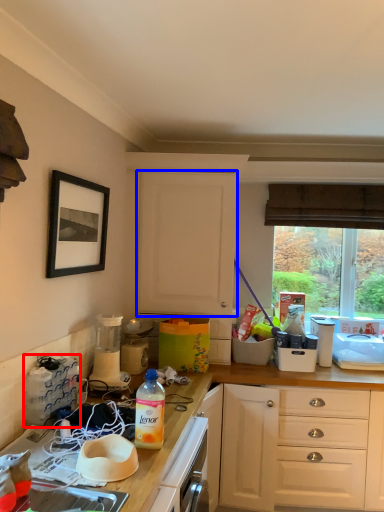
Question: Among these objects, which one is farthest to the camera, appliance (highlighted by a red box) or cabinetry (highlighted by a blue box)?

Choices:
 (A) appliance
 (B) cabinetry

Answer: (B)